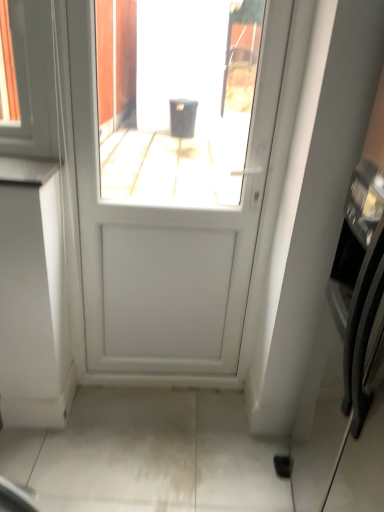
Question: Does point (261, 281) appear closer or farther from the camera than point (382, 342)?

Choices:
 (A) farther
 (B) closer

Answer: (A)

Question: Is white matte door at center bigger or smaller than satin black oven at right?

Choices:
 (A) small
 (B) big

Answer: (A)

Question: Based on their relative distances, which object is farther from the satin black oven at right?

Choices:
 (A) white matte door at center
 (B) white glossy countertop at left

Answer: (B)

Question: Which object is positioned farthest from the white glossy countertop at left?

Choices:
 (A) satin black oven at right
 (B) white matte door at center

Answer: (A)